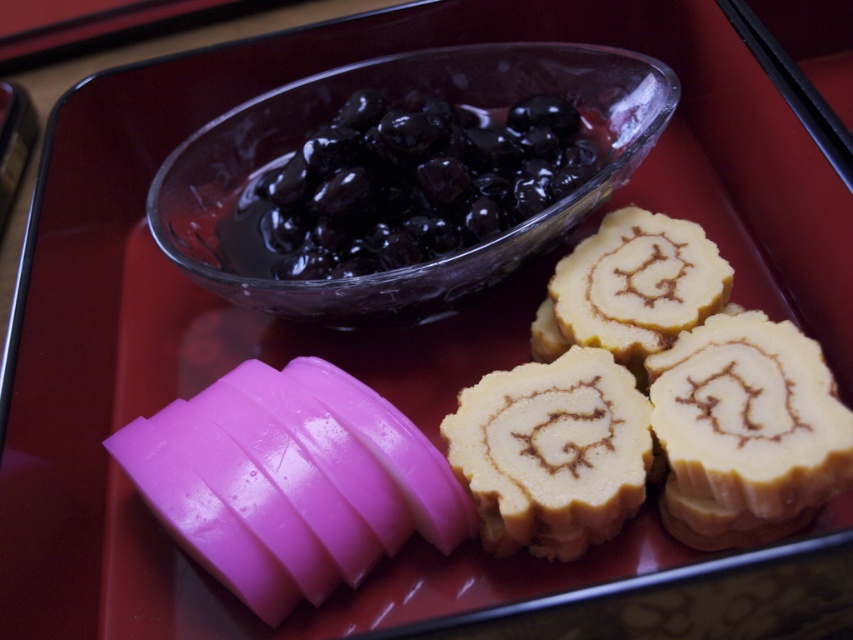
Question: Which object is closer to the camera taking this photo?

Choices:
 (A) glossy dark blue grapes at upper center
 (B) yellow sponge cake at right
 (C) transparent glass bowl at upper center

Answer: (B)

Question: Which object is the closest to the glossy dark blue grapes at upper center?

Choices:
 (A) yellow sponge cake at right
 (B) swirled caramel cake at center
 (C) transparent glass bowl at upper center

Answer: (C)

Question: In this image, where is transparent glass bowl at upper center located relative to glossy dark blue grapes at upper center?

Choices:
 (A) above
 (B) below

Answer: (B)

Question: Among these objects, which one is farthest from the camera?

Choices:
 (A) transparent glass bowl at upper center
 (B) swirled caramel cake at center
 (C) yellow sponge cake at right
 (D) glossy dark blue grapes at upper center

Answer: (D)

Question: Does transparent glass bowl at upper center have a greater width compared to glossy dark blue grapes at upper center?

Choices:
 (A) no
 (B) yes

Answer: (B)

Question: Can you confirm if yellow sponge cake at right is positioned to the right of transparent glass bowl at upper center?

Choices:
 (A) yes
 (B) no

Answer: (A)